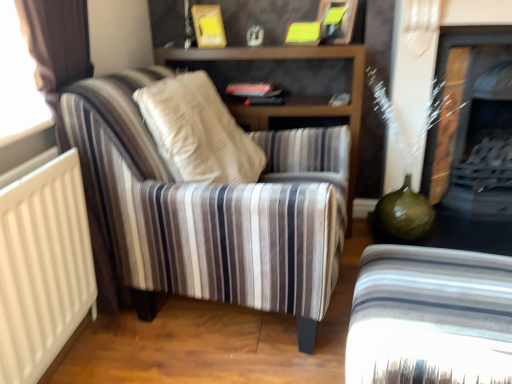
Question: Is striped fabric armchair at lower right, which is the 2th chair from left to right, smaller than matte black fireplace at right?

Choices:
 (A) no
 (B) yes

Answer: (B)

Question: Does striped fabric armchair at lower right, which is the 2th chair from left to right, have a larger size compared to matte black fireplace at right?

Choices:
 (A) yes
 (B) no

Answer: (B)

Question: From the image's perspective, is striped fabric armchair at lower right, which is the 2th chair from left to right, beneath matte black fireplace at right?

Choices:
 (A) no
 (B) yes

Answer: (B)

Question: Could you tell me if striped fabric armchair at lower right, which is the 2th chair from left to right, is turned towards matte black fireplace at right?

Choices:
 (A) no
 (B) yes

Answer: (A)

Question: Is striped fabric armchair at lower right, the 1th chair from the right, not within matte black fireplace at right?

Choices:
 (A) yes
 (B) no

Answer: (A)

Question: Considering their positions, is striped fabric armchair at lower right, which is the 2th chair from left to right, located in front of or behind striped fabric armchair at left, which ranks as the 1th chair in left-to-right order?

Choices:
 (A) behind
 (B) front

Answer: (B)

Question: From a real-world perspective, is striped fabric armchair at lower right, which is the 2th chair from left to right, positioned above or below striped fabric armchair at left, which is the 2th chair from right to left?

Choices:
 (A) above
 (B) below

Answer: (B)

Question: Does point (468, 367) appear closer or farther from the camera than point (291, 160)?

Choices:
 (A) closer
 (B) farther

Answer: (A)

Question: Is striped fabric armchair at lower right, which is the 2th chair from left to right, wider or thinner than striped fabric armchair at left, which is the 2th chair from right to left?

Choices:
 (A) thin
 (B) wide

Answer: (A)

Question: From a real-world perspective, relative to matte black fireplace at right, is striped fabric armchair at lower right, the 1th chair from the right, vertically above or below?

Choices:
 (A) below
 (B) above

Answer: (A)

Question: From the image's perspective, relative to matte black fireplace at right, is striped fabric armchair at lower right, which is the 2th chair from left to right, above or below?

Choices:
 (A) below
 (B) above

Answer: (A)

Question: In the image, is striped fabric armchair at lower right, the 1th chair from the right, positioned in front of or behind matte black fireplace at right?

Choices:
 (A) front
 (B) behind

Answer: (A)

Question: From their relative heights in the image, would you say striped fabric armchair at lower right, the 1th chair from the right, is taller or shorter than matte black fireplace at right?

Choices:
 (A) tall
 (B) short

Answer: (B)

Question: Looking at their shapes, would you say matte black fireplace at right is wider or thinner than striped fabric armchair at lower right, which is the 2th chair from left to right?

Choices:
 (A) thin
 (B) wide

Answer: (A)

Question: Based on their sizes in the image, would you say matte black fireplace at right is bigger or smaller than striped fabric armchair at lower right, the 1th chair from the right?

Choices:
 (A) big
 (B) small

Answer: (A)